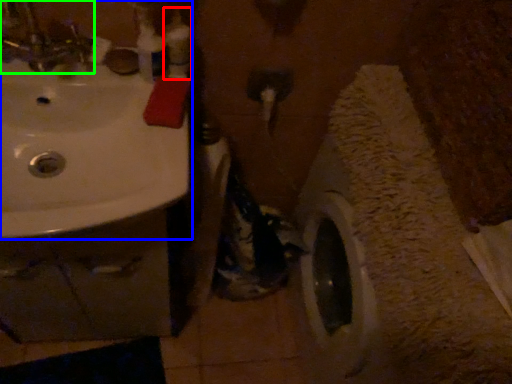
Question: Considering the real-world distances, which object is closest to toiletry (highlighted by a red box)? sink (highlighted by a blue box) or tap (highlighted by a green box).

Choices:
 (A) sink
 (B) tap

Answer: (A)